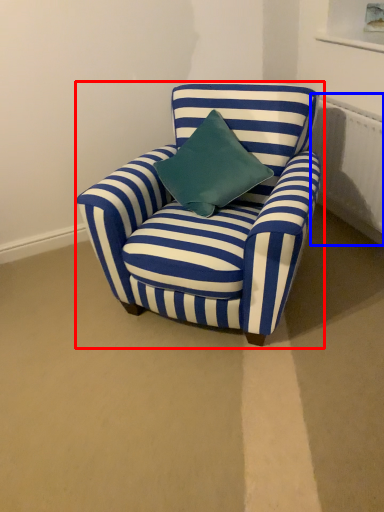
Question: Which point is further to the camera, chair (highlighted by a red box) or radiator (highlighted by a blue box)?

Choices:
 (A) chair
 (B) radiator

Answer: (B)